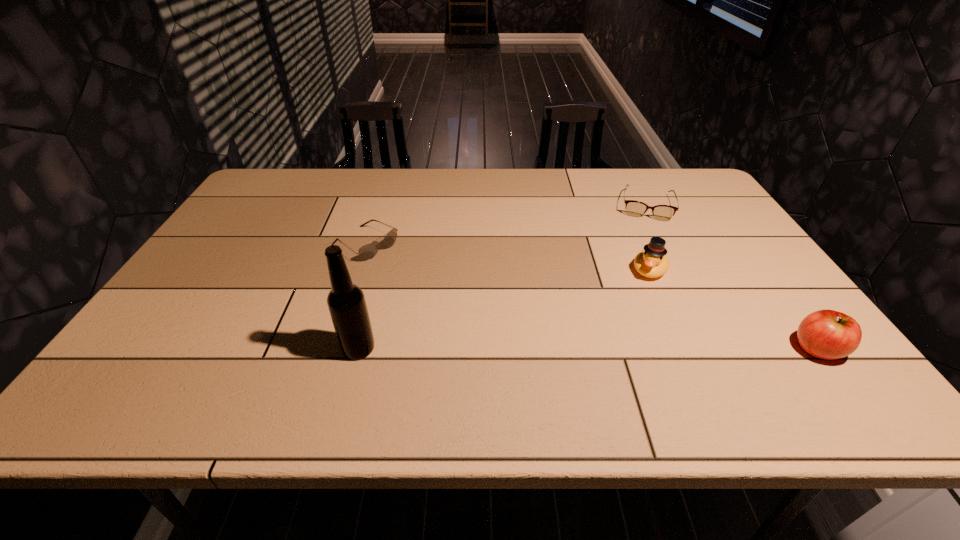
You are a GUI agent. You are given a task and a screenshot of the screen. Output one action in this format:
    pyautogui.click(x=<x>, y=<y>)
    Task: Click on the free space between the duck and the farthest object
    
    Given the screenshot: What is the action you would take?
    pyautogui.click(x=647, y=238)

Image resolution: width=960 pixels, height=540 pixels. In order to click on empty space that is in between the tallest object and the apple in this screenshot , I will do `click(588, 349)`.

Find the location of `blank region between the sunglasses and the duck`. blank region between the sunglasses and the duck is located at coordinates (508, 257).

Identify the location of vacant point located between the sunglasses and the farthest object. (506, 225).

Image resolution: width=960 pixels, height=540 pixels. Identify the location of blank region between the apple and the farthest object. (732, 277).

The image size is (960, 540). Find the location of `unoccupied position between the sunglasses and the rightmost object`. unoccupied position between the sunglasses and the rightmost object is located at coordinates (592, 296).

Image resolution: width=960 pixels, height=540 pixels. Find the location of `free space that is in between the spectacles and the beer bottle`. free space that is in between the spectacles and the beer bottle is located at coordinates (502, 277).

The image size is (960, 540). What are the coordinates of `the closest object relative to the sunglasses` in the screenshot? It's located at (347, 306).

I want to click on object that stands as the fourth closest to the duck, so click(x=347, y=306).

Where is `vacant space that satisfies the following two spatial constraints: 1. on the front side of the duck; 2. on the left side of the sunglasses`? Image resolution: width=960 pixels, height=540 pixels. vacant space that satisfies the following two spatial constraints: 1. on the front side of the duck; 2. on the left side of the sunglasses is located at coordinates (359, 269).